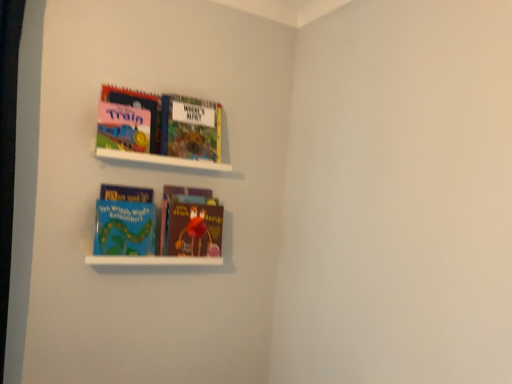
Question: Is matte pink board book at upper left, the 1th book positioned from the top, to the left of brown matte book at center, placed as the first book when sorted from bottom to top, from the viewer's perspective?

Choices:
 (A) yes
 (B) no

Answer: (A)

Question: Considering the relative sizes of matte pink board book at upper left, the 1th book positioned from the top, and brown matte book at center, placed as the first book when sorted from bottom to top, in the image provided, is matte pink board book at upper left, the 1th book positioned from the top, bigger than brown matte book at center, placed as the first book when sorted from bottom to top,?

Choices:
 (A) yes
 (B) no

Answer: (B)

Question: Considering the relative sizes of matte pink board book at upper left, the 4th book positioned from the bottom, and brown matte book at center, acting as the 4th book starting from the top, in the image provided, is matte pink board book at upper left, the 4th book positioned from the bottom, shorter than brown matte book at center, acting as the 4th book starting from the top,?

Choices:
 (A) no
 (B) yes

Answer: (B)

Question: Considering the relative positions of matte pink board book at upper left, the 4th book positioned from the bottom, and brown matte book at center, placed as the first book when sorted from bottom to top, in the image provided, is matte pink board book at upper left, the 4th book positioned from the bottom, to the right of brown matte book at center, placed as the first book when sorted from bottom to top, from the viewer's perspective?

Choices:
 (A) yes
 (B) no

Answer: (B)

Question: From the image's perspective, does matte pink board book at upper left, the 1th book positioned from the top, appear higher than brown matte book at center, acting as the 4th book starting from the top?

Choices:
 (A) yes
 (B) no

Answer: (A)

Question: Is hardcover book at upper center, the 3th book from the bottom, bigger or smaller than brown matte book at center, acting as the 4th book starting from the top?

Choices:
 (A) small
 (B) big

Answer: (A)

Question: In terms of width, does hardcover book at upper center, the 3th book from the bottom, look wider or thinner when compared to brown matte book at center, placed as the first book when sorted from bottom to top?

Choices:
 (A) thin
 (B) wide

Answer: (B)

Question: Is hardcover book at upper center, the 2th book viewed from the top, inside the boundaries of brown matte book at center, placed as the first book when sorted from bottom to top, or outside?

Choices:
 (A) outside
 (B) inside

Answer: (A)

Question: From the image's perspective, relative to brown matte book at center, placed as the first book when sorted from bottom to top, is hardcover book at upper center, the 3th book from the bottom, above or below?

Choices:
 (A) below
 (B) above

Answer: (B)

Question: Considering the positions of point (208, 263) and point (116, 89), is point (208, 263) closer or farther from the camera than point (116, 89)?

Choices:
 (A) closer
 (B) farther

Answer: (B)

Question: In terms of width, does white matte shelf at lower center, placed as the 1th cabinet when sorted from bottom to top, look wider or thinner when compared to matte pink board book at upper left, the 4th book positioned from the bottom?

Choices:
 (A) thin
 (B) wide

Answer: (B)

Question: Is white matte shelf at lower center, positioned as the second cabinet in top-to-bottom order, bigger or smaller than matte pink board book at upper left, the 4th book positioned from the bottom?

Choices:
 (A) small
 (B) big

Answer: (A)

Question: From their relative heights in the image, would you say white matte shelf at lower center, positioned as the second cabinet in top-to-bottom order, is taller or shorter than matte pink board book at upper left, the 1th book positioned from the top?

Choices:
 (A) tall
 (B) short

Answer: (B)

Question: Looking at their shapes, would you say brown matte book at center, placed as the first book when sorted from bottom to top, is wider or thinner than blue matte book at lower left, which appears as the second book when ordered from the bottom?

Choices:
 (A) wide
 (B) thin

Answer: (A)

Question: Does point (215, 235) appear closer or farther from the camera than point (132, 198)?

Choices:
 (A) closer
 (B) farther

Answer: (B)